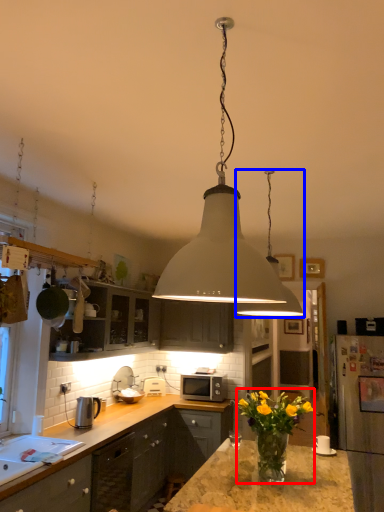
Question: Among these objects, which one is farthest to the camera, floral arrangement (highlighted by a red box) or lamp (highlighted by a blue box)?

Choices:
 (A) floral arrangement
 (B) lamp

Answer: (B)